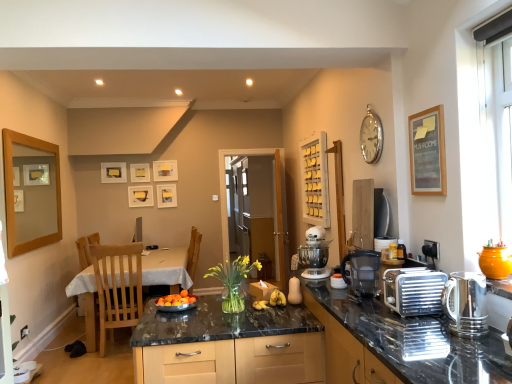
Find the location of a particular element. empty space that is ontop of metallic silver bowl at center is located at coordinates (173, 298).